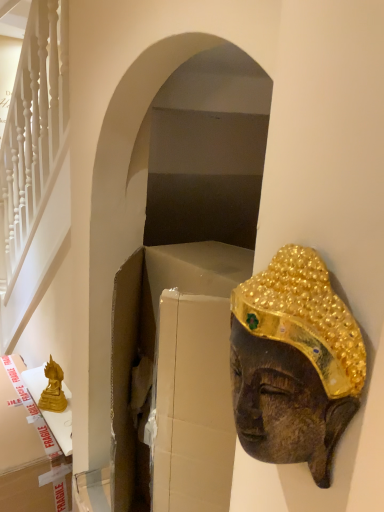
Question: Is gold cardboard box at left shorter than gold matte statue at lower left?

Choices:
 (A) yes
 (B) no

Answer: (B)

Question: From a real-world perspective, is gold cardboard box at left physically above gold matte statue at lower left?

Choices:
 (A) yes
 (B) no

Answer: (B)

Question: Is gold cardboard box at left touching gold matte statue at lower left?

Choices:
 (A) yes
 (B) no

Answer: (B)

Question: Is gold cardboard box at left further to camera compared to gold matte statue at lower left?

Choices:
 (A) yes
 (B) no

Answer: (B)

Question: Can you confirm if gold cardboard box at left is smaller than gold matte statue at lower left?

Choices:
 (A) yes
 (B) no

Answer: (B)

Question: Do you think gold textured mask at right is within gold cardboard box at left, or outside of it?

Choices:
 (A) inside
 (B) outside

Answer: (B)

Question: Looking at their shapes, would you say gold textured mask at right is wider or thinner than gold cardboard box at left?

Choices:
 (A) wide
 (B) thin

Answer: (B)

Question: From a real-world perspective, is gold textured mask at right above or below gold cardboard box at left?

Choices:
 (A) above
 (B) below

Answer: (A)

Question: From the image's perspective, relative to gold cardboard box at left, is gold textured mask at right above or below?

Choices:
 (A) below
 (B) above

Answer: (B)

Question: Looking at their shapes, would you say gold matte statue at lower left is wider or thinner than gold textured mask at right?

Choices:
 (A) thin
 (B) wide

Answer: (B)

Question: From a real-world perspective, relative to gold textured mask at right, is gold matte statue at lower left vertically above or below?

Choices:
 (A) above
 (B) below

Answer: (B)

Question: Considering the positions of gold matte statue at lower left and gold textured mask at right in the image, is gold matte statue at lower left bigger or smaller than gold textured mask at right?

Choices:
 (A) big
 (B) small

Answer: (A)

Question: Is point (41, 398) positioned closer to the camera than point (345, 381)?

Choices:
 (A) closer
 (B) farther

Answer: (B)

Question: In terms of size, does gold textured mask at right appear bigger or smaller than gold matte statue at lower left?

Choices:
 (A) small
 (B) big

Answer: (A)

Question: Choose the correct answer: Is gold textured mask at right inside gold matte statue at lower left or outside it?

Choices:
 (A) inside
 (B) outside

Answer: (B)